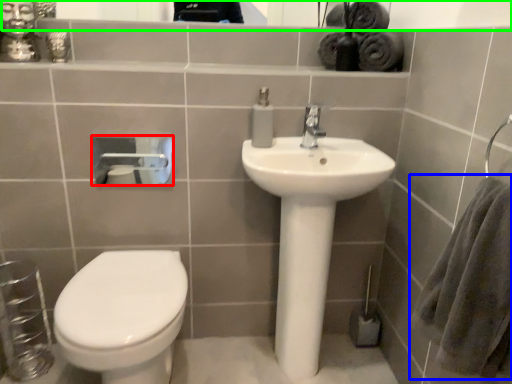
Question: Which object is positioned farthest from toilet paper (highlighted by a red box)? Select from bath towel (highlighted by a blue box) and mirror (highlighted by a green box).

Choices:
 (A) bath towel
 (B) mirror

Answer: (A)